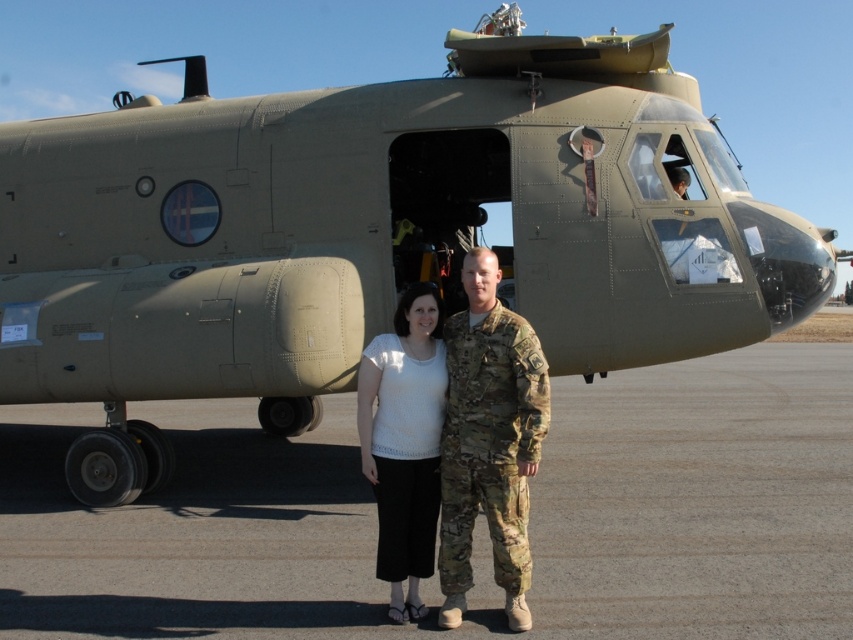
Question: Observing the image, what is the correct spatial positioning of gray asphalt at center in reference to camouflage uniform at center?

Choices:
 (A) below
 (B) above

Answer: (A)

Question: Based on their relative distances, which object is nearer to the white knit top at center?

Choices:
 (A) gray asphalt at center
 (B) camouflage uniform at center

Answer: (B)

Question: Is gray asphalt at center above camouflage uniform at center?

Choices:
 (A) yes
 (B) no

Answer: (B)

Question: Does gray asphalt at center have a larger size compared to camouflage uniform at center?

Choices:
 (A) yes
 (B) no

Answer: (A)

Question: Which point is closer to the camera?

Choices:
 (A) camouflage uniform at center
 (B) gray asphalt at center

Answer: (A)

Question: Which object is the closest to the camouflage uniform at center?

Choices:
 (A) white knit top at center
 (B) gray asphalt at center

Answer: (A)